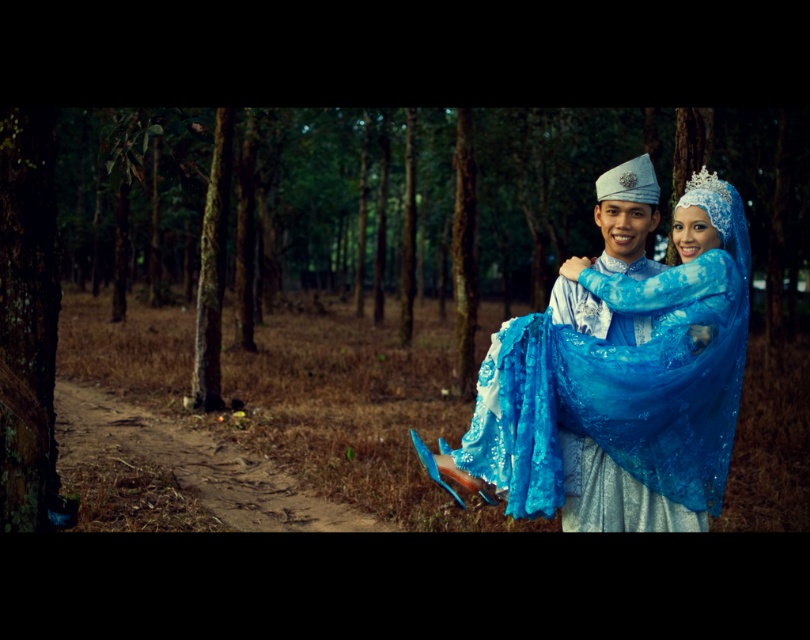
Can you confirm if green matte trees at center is positioned above lustrous blue fabric dress at center?

Correct, green matte trees at center is located above lustrous blue fabric dress at center.

Between green matte trees at center and lustrous blue fabric dress at center, which one appears on the right side from the viewer's perspective?

From the viewer's perspective, green matte trees at center appears more on the right side.

Where is `green matte trees at center`? This screenshot has width=810, height=640. green matte trees at center is located at coordinates [480, 276].

Between lustrous blue fabric dress at center and lustrous blue fabric at center, which one is positioned lower?

lustrous blue fabric dress at center is lower down.

Is lustrous blue fabric dress at center thinner than lustrous blue fabric at center?

No, lustrous blue fabric dress at center is not thinner than lustrous blue fabric at center.

Which is in front, point (492, 417) or point (583, 448)?

Point (492, 417)

Find the location of a particular element. lustrous blue fabric dress at center is located at coordinates (621, 371).

Is green matte trees at center below lustrous blue fabric at center?

No.

Does green matte trees at center appear on the right side of lustrous blue fabric at center?

Correct, you'll find green matte trees at center to the right of lustrous blue fabric at center.

Describe the element at coordinates (480, 276) in the screenshot. I see `green matte trees at center` at that location.

The height and width of the screenshot is (640, 810). Identify the location of green matte trees at center. (480, 276).